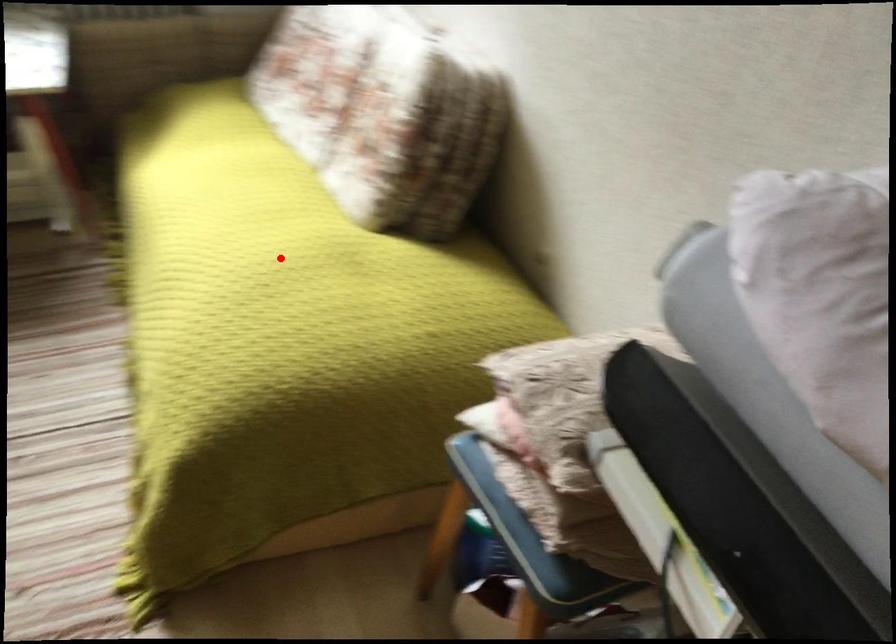
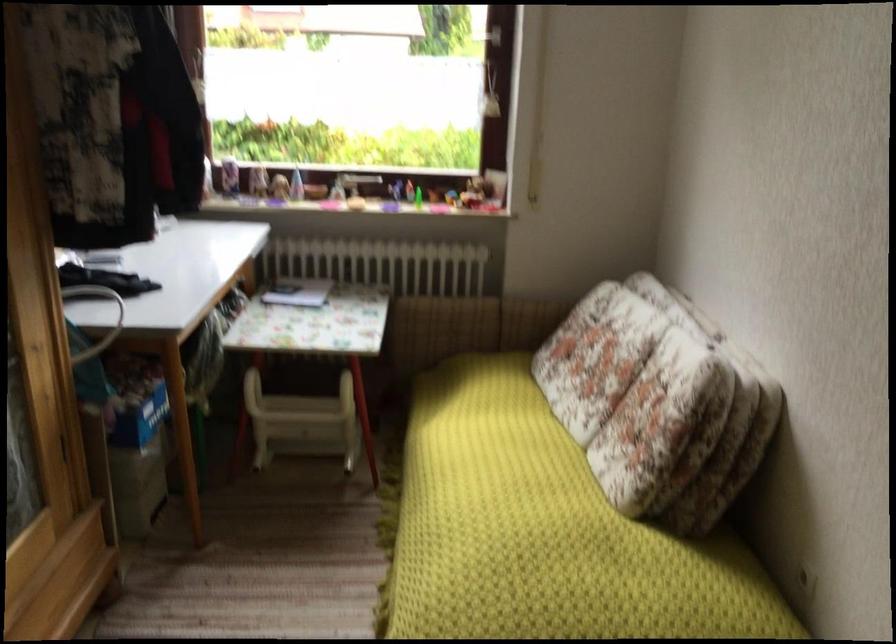
The point at the highlighted location is marked in the first image. Where is the corresponding point in the second image?

(544, 532)